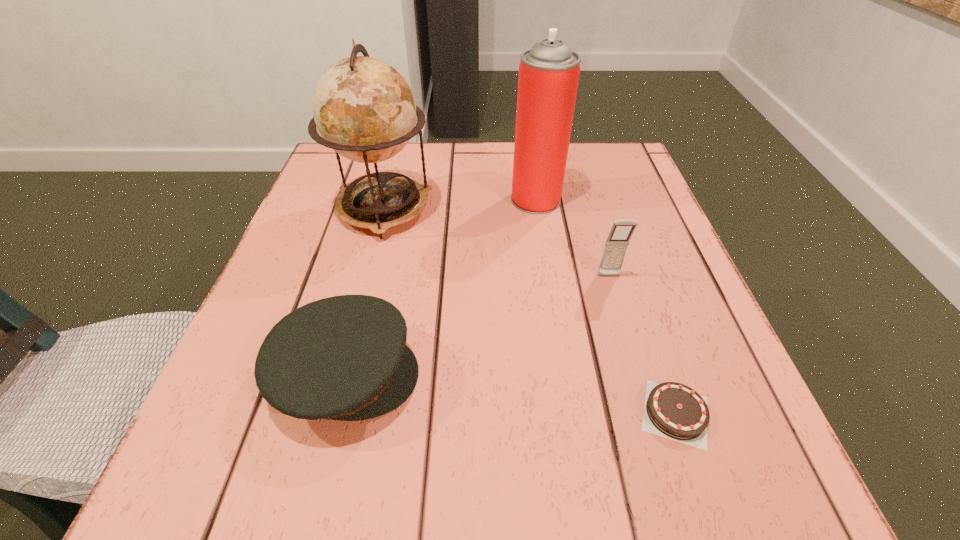
Locate an element on the screen. vacant space in between the third shortest object and the globe is located at coordinates (496, 243).

Locate an element on the screen. Image resolution: width=960 pixels, height=540 pixels. vacant space that's between the chocolate cake and the third object from right to left is located at coordinates (606, 306).

Locate an element on the screen. empty location between the second shortest object and the globe is located at coordinates (365, 293).

Where is `vacant space that is in between the globe and the aerosol can`? vacant space that is in between the globe and the aerosol can is located at coordinates (460, 205).

Image resolution: width=960 pixels, height=540 pixels. I want to click on free spot between the globe and the third object from left to right, so click(x=460, y=205).

The image size is (960, 540). What are the coordinates of `vacant space that is in between the beret and the chocolate cake` in the screenshot? It's located at (511, 394).

The image size is (960, 540). What are the coordinates of `empty space that is in between the globe and the shortest object` in the screenshot? It's located at (529, 312).

I want to click on object identified as the closest to the third object from right to left, so click(x=365, y=111).

Find the location of a particular element. The width and height of the screenshot is (960, 540). object identified as the fourth closest to the shortest object is located at coordinates (365, 111).

Locate an element on the screen. Image resolution: width=960 pixels, height=540 pixels. vacant position in the image that satisfies the following two spatial constraints: 1. on the front-facing side of the third shortest object; 2. on the front-facing side of the beret is located at coordinates (638, 375).